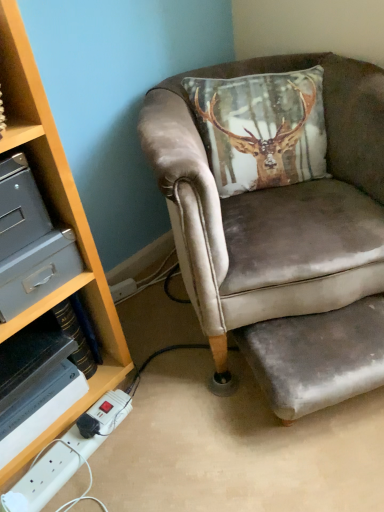
Question: Considering their positions, is velvet grey footrest at lower right located in front of or behind velvet brown armchair at center?

Choices:
 (A) behind
 (B) front

Answer: (A)

Question: Based on their sizes in the image, would you say velvet grey footrest at lower right is bigger or smaller than velvet brown armchair at center?

Choices:
 (A) big
 (B) small

Answer: (B)

Question: Which object is positioned closest to the velvet brown armchair at center?

Choices:
 (A) white plastic power strip at lower left
 (B) velvet grey footrest at lower right
 (C) metallic gray drawer at left

Answer: (B)

Question: Estimate the real-world distances between objects in this image. Which object is closer to the white plastic power strip at lower left?

Choices:
 (A) velvet brown armchair at center
 (B) metallic gray drawer at left
 (C) velvet grey footrest at lower right

Answer: (B)